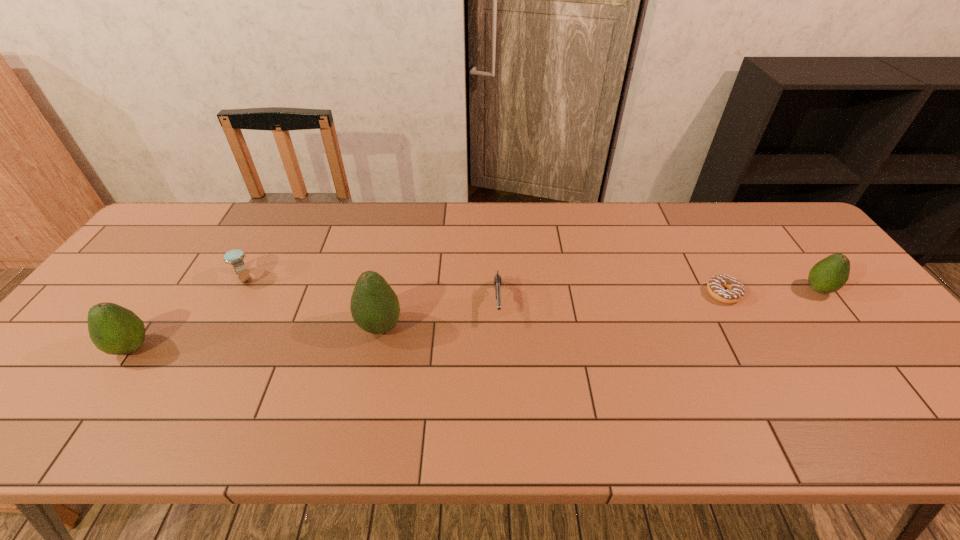
To ensure equal spacing by inserting another avocado among them, please point out a vacant spot for this new avocado. Please provide its 2D coordinates. Your answer should be formatted as a tuple, i.e. [(x, y)], where the tuple contains the x and y coordinates of a point satisfying the conditions above.

[(608, 307)]